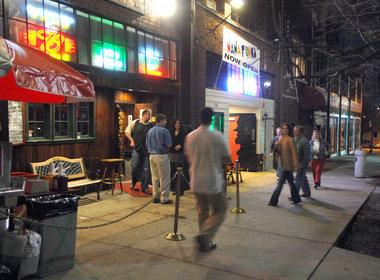
Identify the location of open grey trashcan with black trash bag. The width and height of the screenshot is (380, 280). (65, 218).